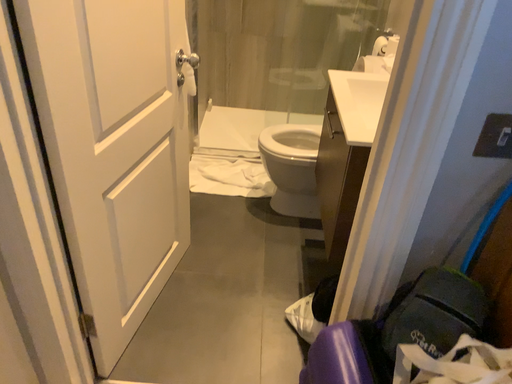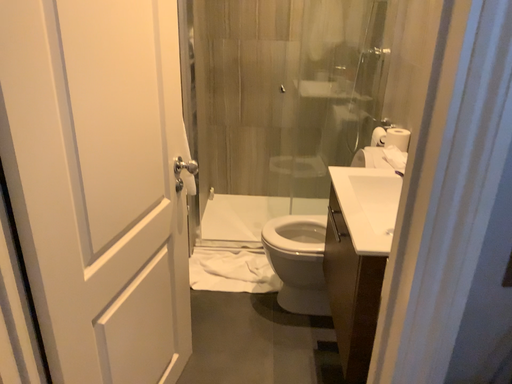
Question: How did the camera likely rotate when shooting the video?

Choices:
 (A) rotated upward
 (B) rotated downward

Answer: (A)